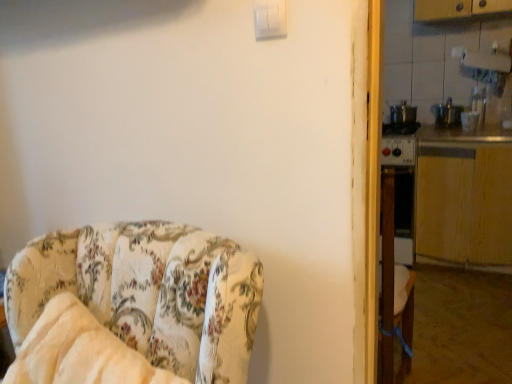
Question: From a real-world perspective, is metallic silver counter top at right, which appears as the first counter top when viewed from the top, physically located above or below white plastic light switch at upper center?

Choices:
 (A) below
 (B) above

Answer: (A)

Question: Considering the positions of point (496, 129) and point (281, 0), is point (496, 129) closer or farther from the camera than point (281, 0)?

Choices:
 (A) farther
 (B) closer

Answer: (A)

Question: Which of these objects is positioned closest to the metallic silver counter top at right, which ranks as the second counter top in bottom-to-top order?

Choices:
 (A) floral fabric chair at left
 (B) wooden at right, placed as the 2th counter top when sorted from top to bottom
 (C) white plastic light switch at upper center

Answer: (B)

Question: Based on their relative distances, which object is farther from the wooden at right, which appears as the first counter top when ordered from the bottom?

Choices:
 (A) metallic silver counter top at right, which ranks as the second counter top in bottom-to-top order
 (B) white plastic light switch at upper center
 (C) floral fabric chair at left

Answer: (C)